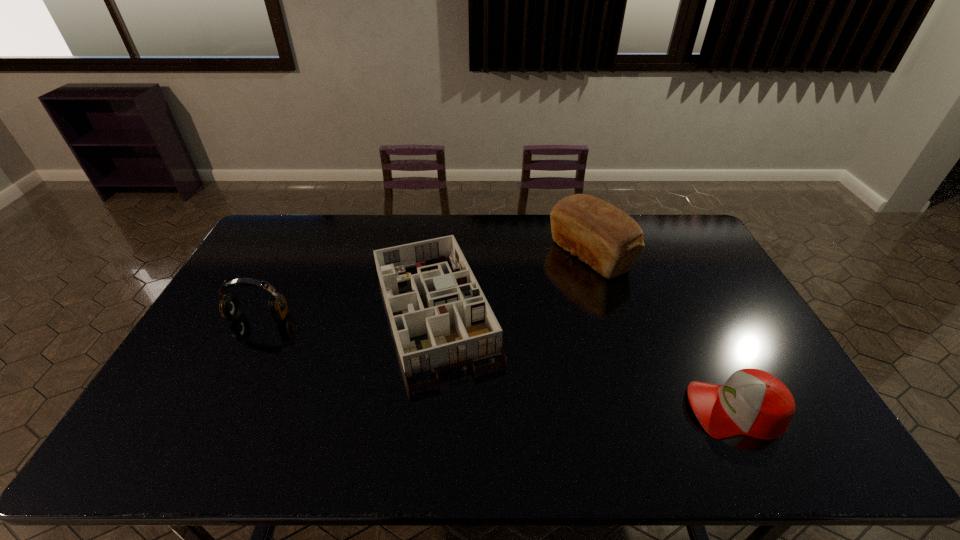
Where is `free space at the far left corner of the desktop`? free space at the far left corner of the desktop is located at coordinates (293, 251).

At what (x,y) coordinates should I click in order to perform the action: click on free spot between the baseball cap and the bread. Please return your answer as a coordinate pair (x, y). Looking at the image, I should click on [x=662, y=333].

Identify the location of unoccupied position between the baseball cap and the bread. This screenshot has height=540, width=960. (662, 333).

You are a GUI agent. You are given a task and a screenshot of the screen. Output one action in this format:
    pyautogui.click(x=<x>, y=<y>)
    Task: Click on the free point between the second object from left to right and the bread
    
    Given the screenshot: What is the action you would take?
    pyautogui.click(x=513, y=285)

Identify the location of free space between the dollhouse and the third shortest object. (348, 316).

Find the location of a particular element. free area in between the dollhouse and the baseball cap is located at coordinates (586, 362).

The image size is (960, 540). I want to click on object that is the third closest to the tallest object, so click(x=230, y=308).

At what (x,y) coordinates should I click in order to perform the action: click on object that can be found as the closest to the tallest object. Please return your answer as a coordinate pair (x, y). Looking at the image, I should click on (450, 307).